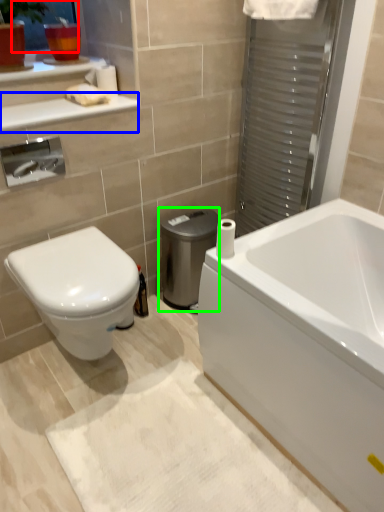
Question: Which object is positioned farthest from window screen (highlighted by a red box)? Select from balustrade (highlighted by a blue box) and water heater (highlighted by a green box).

Choices:
 (A) balustrade
 (B) water heater

Answer: (B)